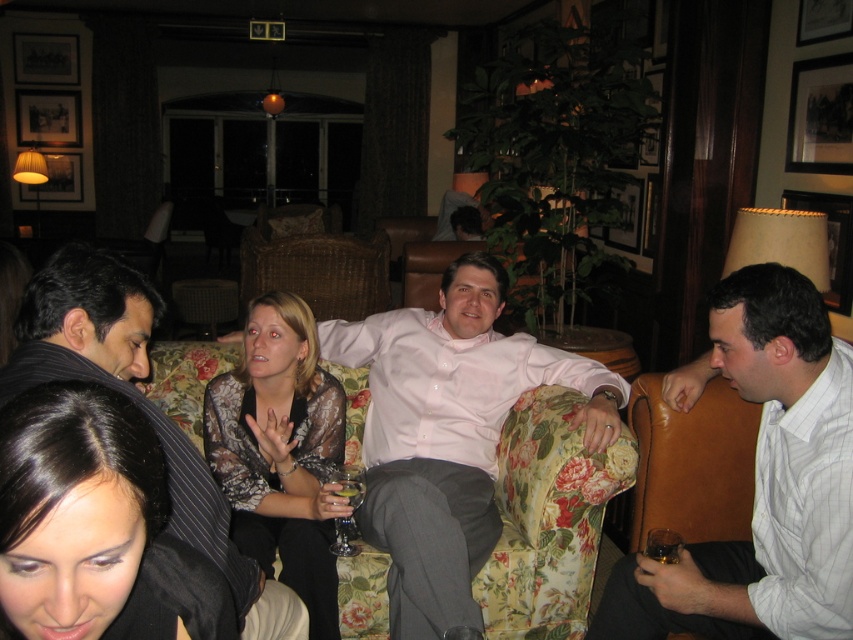
You are standing in the lounge and want to move from point A to point B. Point A is at coordinates point (254, 358) and point B is at coordinates point (140, 333). Considering the spatial arrangement described, which direction should you move to go from point A to point B?

To move from point A at coordinates point (254, 358) to point B at coordinates point (140, 333), you should move downward and slightly to the left since point B is closer to the viewer than point A.

You are a bartender preparing drinks for a party. You have two glasses on the counter in front of you. The scene shows a translucent glass at lower right and a translucent glass at lower center. Which glass is positioned further to the right?

The translucent glass at lower right is positioned to the right of the translucent glass at lower center, so it is further to the right.